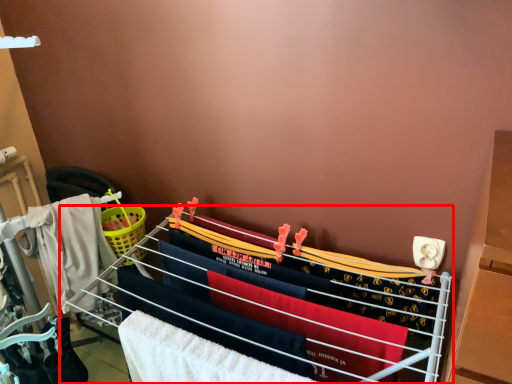
Question: From the image's perspective, what is the correct spatial relationship of furniture (annotated by the red box) in relation to beach towel?

Choices:
 (A) below
 (B) above

Answer: (A)